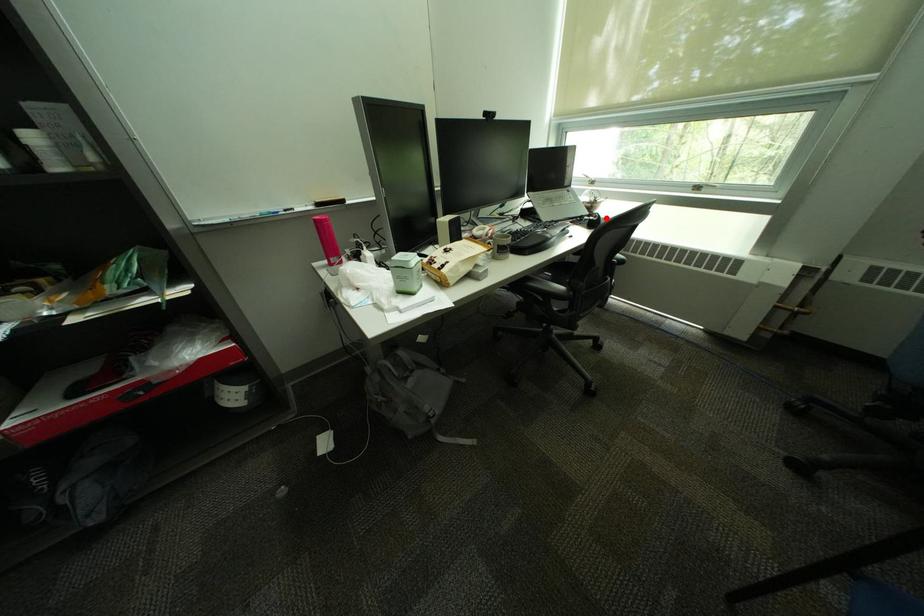
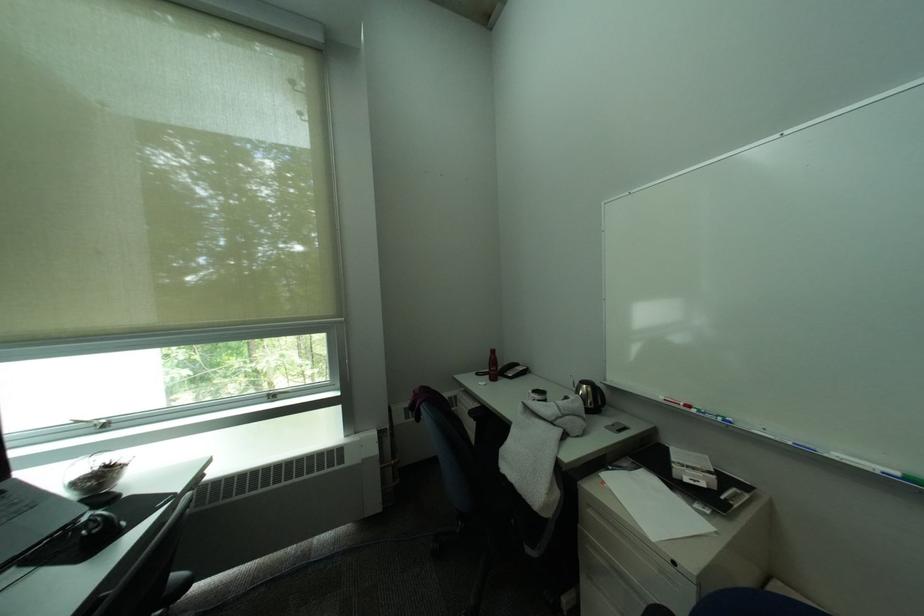
Where in the second image is the point corresponding to the highlighted location from the first image?

(106, 528)